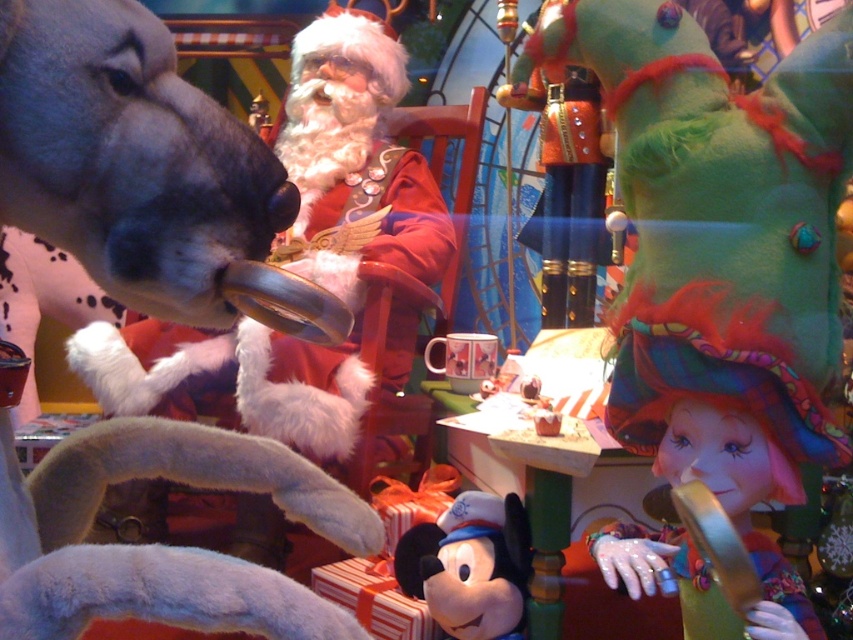
Measure the distance between point (309, 202) and camera.

They are 8.46 feet apart.

Between point (280, 435) and point (746, 404), which one is positioned in front?

Point (746, 404)

Find the location of `fuzzy red santa at center`. fuzzy red santa at center is located at coordinates (306, 262).

Does green felt hat at right appear on the left side of multicolored tulle hat at lower right?

Correct, you'll find green felt hat at right to the left of multicolored tulle hat at lower right.

Between green felt hat at right and multicolored tulle hat at lower right, which one appears on the right side from the viewer's perspective?

From the viewer's perspective, multicolored tulle hat at lower right appears more on the right side.

The width and height of the screenshot is (853, 640). In order to click on green felt hat at right in this screenshot , I will do `click(718, 221)`.

Which is above, fuzzy red santa at center or soft plush mickey mouse at center?

fuzzy red santa at center is above.

Consider the image. Does fuzzy red santa at center appear over soft plush mickey mouse at center?

Correct, fuzzy red santa at center is located above soft plush mickey mouse at center.

Who is more distant from viewer, (x=140, y=342) or (x=473, y=627)?

Positioned behind is point (x=140, y=342).

Where is `fuzzy red santa at center`? The width and height of the screenshot is (853, 640). fuzzy red santa at center is located at coordinates (306, 262).